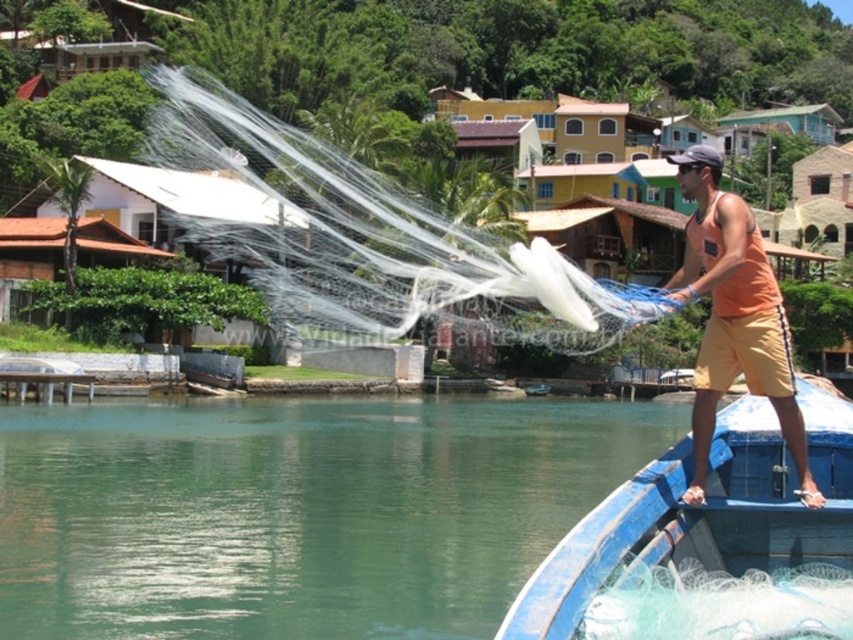
Question: Which point is farther from the camera taking this photo?

Choices:
 (A) (566, 616)
 (B) (695, 497)

Answer: (B)

Question: Can you confirm if green translucent water at lower left is wider than transparent nylon fishing net at center?

Choices:
 (A) no
 (B) yes

Answer: (A)

Question: Can you confirm if green translucent water at lower left is smaller than orange cotton tank top at right?

Choices:
 (A) yes
 (B) no

Answer: (A)

Question: Which point appears closest to the camera in this image?

Choices:
 (A) (699, 220)
 (B) (445, 580)

Answer: (A)

Question: Which object appears farthest from the camera in this image?

Choices:
 (A) blue painted wood boat at right
 (B) transparent nylon fishing net at center

Answer: (B)

Question: Does green translucent water at lower left lie in front of orange cotton tank top at right?

Choices:
 (A) no
 (B) yes

Answer: (A)